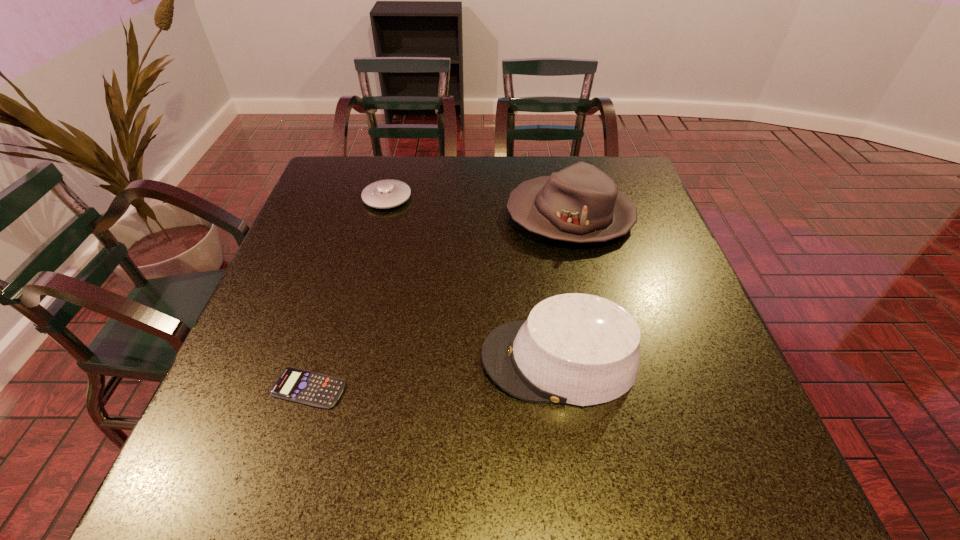
The width and height of the screenshot is (960, 540). I want to click on vacant space located on the front-facing side of the nearer hat, so click(x=320, y=360).

Identify the location of free point located on the front-facing side of the nearer hat. The height and width of the screenshot is (540, 960). click(295, 360).

Identify the location of free space located 0.140m on the left of the third tallest object. The image size is (960, 540). 314,198.

This screenshot has height=540, width=960. Find the location of `free space located on the back of the calculator`. free space located on the back of the calculator is located at coordinates (349, 257).

Where is `hat located at the far edge`? hat located at the far edge is located at coordinates (580, 203).

The image size is (960, 540). I want to click on saucer located in the far edge section of the desktop, so click(x=389, y=193).

Where is `saucer present at the left edge`? This screenshot has width=960, height=540. saucer present at the left edge is located at coordinates (389, 193).

Where is `calculator present at the left edge`? The height and width of the screenshot is (540, 960). calculator present at the left edge is located at coordinates (297, 385).

The width and height of the screenshot is (960, 540). Identify the location of object located at the right edge. (580, 203).

Find the location of a particular element. This screenshot has height=540, width=960. object situated at the far left corner is located at coordinates (389, 193).